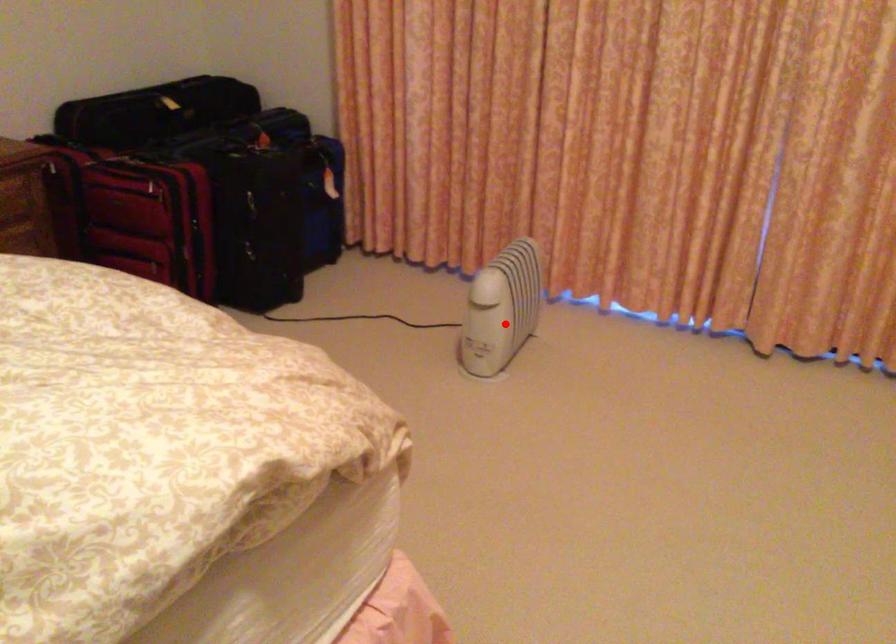
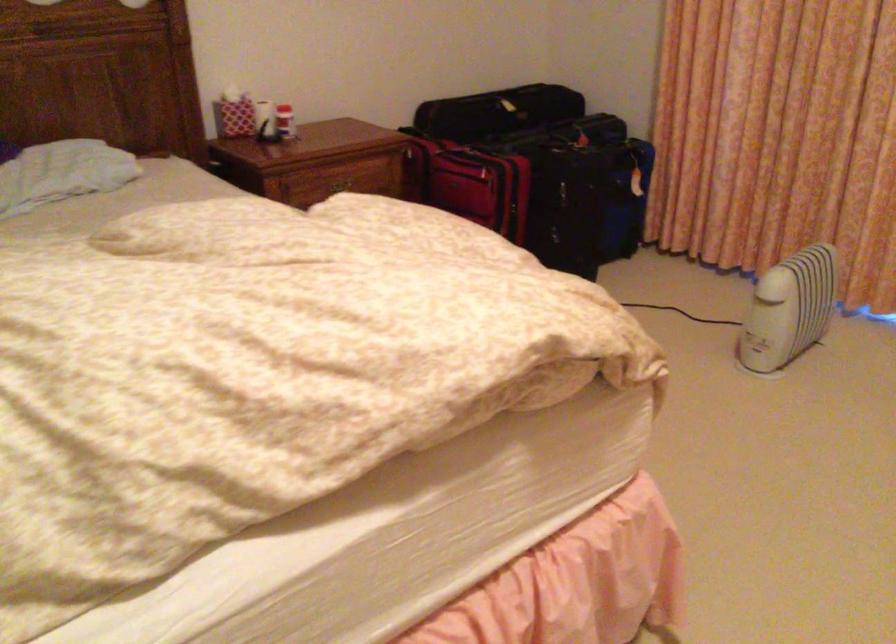
Where in the second image is the point corresponding to the highlighted location from the first image?

(789, 308)